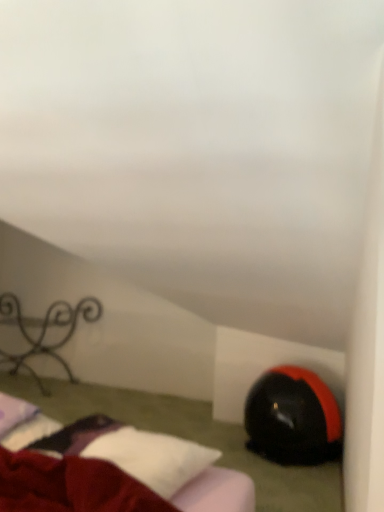
Question: Should I look upward or downward to see black matte bean bag chair at lower right?

Choices:
 (A) up
 (B) down

Answer: (B)

Question: Does black matte bean bag chair at lower right turn towards velvet red bed at lower left?

Choices:
 (A) no
 (B) yes

Answer: (B)

Question: Would you say black matte bean bag chair at lower right is a long distance from velvet red bed at lower left?

Choices:
 (A) no
 (B) yes

Answer: (A)

Question: Is the position of black matte bean bag chair at lower right more distant than that of velvet red bed at lower left?

Choices:
 (A) no
 (B) yes

Answer: (B)

Question: Is black matte bean bag chair at lower right outside of velvet red bed at lower left?

Choices:
 (A) yes
 (B) no

Answer: (A)

Question: Considering the relative sizes of black matte bean bag chair at lower right and velvet red bed at lower left in the image provided, is black matte bean bag chair at lower right taller than velvet red bed at lower left?

Choices:
 (A) no
 (B) yes

Answer: (B)

Question: From the image's perspective, would you say black matte bean bag chair at lower right is positioned over velvet red bed at lower left?

Choices:
 (A) yes
 (B) no

Answer: (B)

Question: From a real-world perspective, is iron wrought iron at left located higher than velvet red bed at lower left?

Choices:
 (A) no
 (B) yes

Answer: (B)

Question: Is iron wrought iron at left to the right of velvet red bed at lower left from the viewer's perspective?

Choices:
 (A) no
 (B) yes

Answer: (A)

Question: Is the depth of iron wrought iron at left less than that of velvet red bed at lower left?

Choices:
 (A) no
 (B) yes

Answer: (A)

Question: Considering the relative sizes of iron wrought iron at left and velvet red bed at lower left in the image provided, is iron wrought iron at left taller than velvet red bed at lower left?

Choices:
 (A) no
 (B) yes

Answer: (B)

Question: From a real-world perspective, is iron wrought iron at left physically below velvet red bed at lower left?

Choices:
 (A) yes
 (B) no

Answer: (B)

Question: From the image's perspective, does iron wrought iron at left appear lower than velvet red bed at lower left?

Choices:
 (A) yes
 (B) no

Answer: (B)

Question: Is black matte bean bag chair at lower right not inside iron wrought iron at left?

Choices:
 (A) yes
 (B) no

Answer: (A)